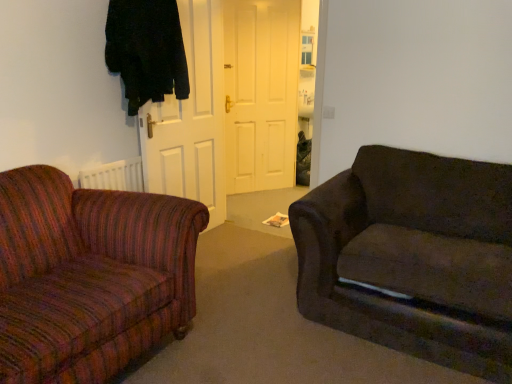
Question: Is white matte door at center, which is the 2th door from left to right, positioned with its back to dark fabric couch at right?

Choices:
 (A) no
 (B) yes

Answer: (A)

Question: Is there a large distance between white matte door at center, which is the first door in back-to-front order, and dark fabric couch at right?

Choices:
 (A) no
 (B) yes

Answer: (B)

Question: Considering the relative sizes of white matte door at center, acting as the first door starting from the right, and dark fabric couch at right in the image provided, is white matte door at center, acting as the first door starting from the right, bigger than dark fabric couch at right?

Choices:
 (A) no
 (B) yes

Answer: (A)

Question: From the image's perspective, is white matte door at center, acting as the first door starting from the right, on dark fabric couch at right?

Choices:
 (A) yes
 (B) no

Answer: (A)

Question: Is dark fabric couch at right surrounded by white matte door at center, which is the 2th door from left to right?

Choices:
 (A) yes
 (B) no

Answer: (B)

Question: Considering the relative positions of white matte door at center, acting as the first door starting from the right, and dark fabric couch at right in the image provided, is white matte door at center, acting as the first door starting from the right, behind dark fabric couch at right?

Choices:
 (A) no
 (B) yes

Answer: (B)

Question: Is black fabric coat at upper left aimed at dark fabric couch at right?

Choices:
 (A) yes
 (B) no

Answer: (A)

Question: Is black fabric coat at upper left positioned in front of dark fabric couch at right?

Choices:
 (A) yes
 (B) no

Answer: (B)

Question: From a real-world perspective, does black fabric coat at upper left stand above dark fabric couch at right?

Choices:
 (A) yes
 (B) no

Answer: (A)

Question: From a real-world perspective, is black fabric coat at upper left below dark fabric couch at right?

Choices:
 (A) no
 (B) yes

Answer: (A)

Question: Is black fabric coat at upper left shorter than dark fabric couch at right?

Choices:
 (A) no
 (B) yes

Answer: (B)

Question: From the image's perspective, is black fabric coat at upper left beneath dark fabric couch at right?

Choices:
 (A) yes
 (B) no

Answer: (B)

Question: Does white matte door at center, which ranks as the first door in front-to-back order, have a lesser height compared to white matte door at center, which is the 2th door from left to right?

Choices:
 (A) no
 (B) yes

Answer: (B)